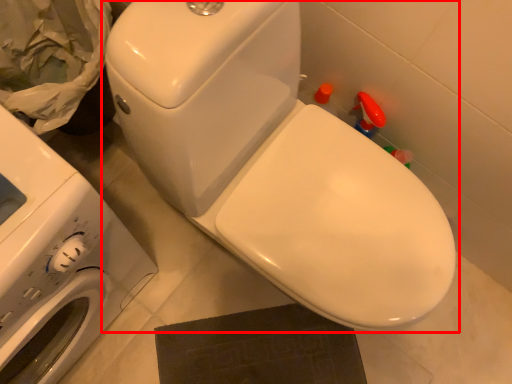
Question: From the image's perspective, considering the relative positions of toilet (annotated by the red box) and washing machine in the image provided, where is toilet (annotated by the red box) located with respect to the staircase?

Choices:
 (A) above
 (B) below

Answer: (A)